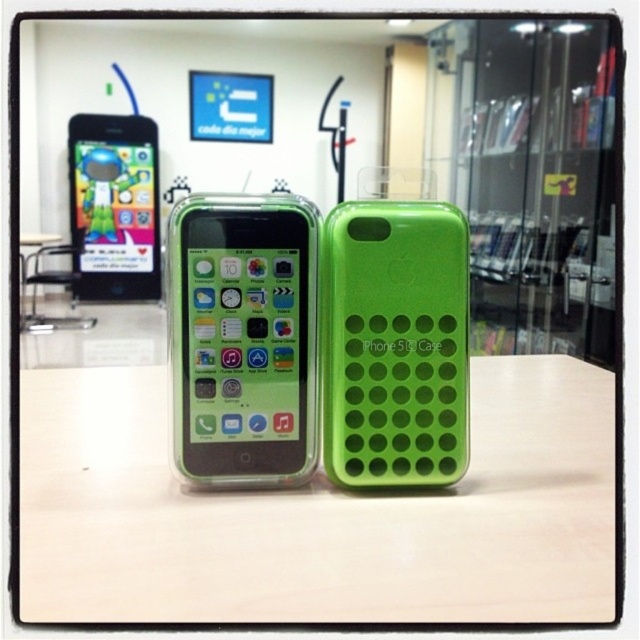
From the picture: You are setting up a display for a tech store. You have a white matte table at center and a green matte iphone case at center. Which object should you place first to ensure stability, considering their sizes?

The white matte table at center is larger in size than the green matte iphone case at center, so you should place the white matte table at center first to establish a stable base before placing the smaller case.

You need to place the green matte smartphone at center into the green matte iphone case at center. Based on their sizes, will the smartphone fit inside the case?

The green matte smartphone at center has a lesser width compared to the green matte iphone case at center, so the smartphone will fit inside the case since it is narrower than the case.